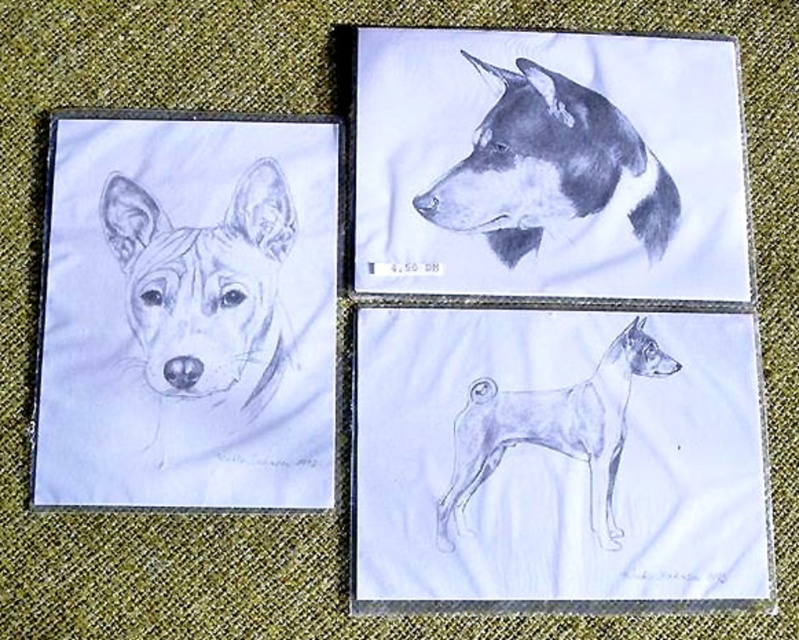
From the picture: You are an art student analyzing the composition of the three pencil sketches displayed on the greenishbrown fabric background. The sketches include the graphite sketch dog at upper center and two others arranged in a grid. Based on their positions, which sketch is positioned higher vertically compared to the others?

The graphite sketch dog at upper center is located at point (549, 168), which means it is positioned higher vertically than the other sketches in the grid.

In the scene shown: You are an art student who wants to frame these two graphite sketches. The frame you have can only accommodate a width of 25 cm. You observe the graphite sketch of dog at upper left and the graphite sketch dog at center. Which of these two sketches can fit into the frame based on their widths?

The graphite sketch of dog at upper left has a smaller width than the graphite sketch dog at center. Since the frame can only hold up to 25 cm, the graphite sketch of dog at upper left is more likely to fit within the frame if its width is under 25 cm, whereas the wider graphite sketch dog at center may exceed the frame size.

You are an art student analyzing the composition of the image. You observe the graphite sketch of dog at upper left and the graphite sketch dog at upper center. Which of these two sketches is positioned higher on the page?

The graphite sketch dog at upper center is positioned higher on the page than the graphite sketch of dog at upper left.